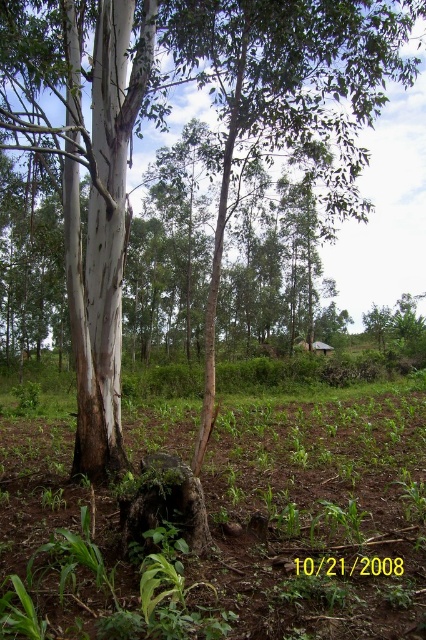
Can you confirm if brown soil at center is positioned above brown rough stump at center?

Incorrect, brown soil at center is not positioned above brown rough stump at center.

Does point (49, 593) come farther from viewer compared to point (178, 500)?

No, it is in front of (178, 500).

Where is `brown soil at center`? brown soil at center is located at coordinates (230, 531).